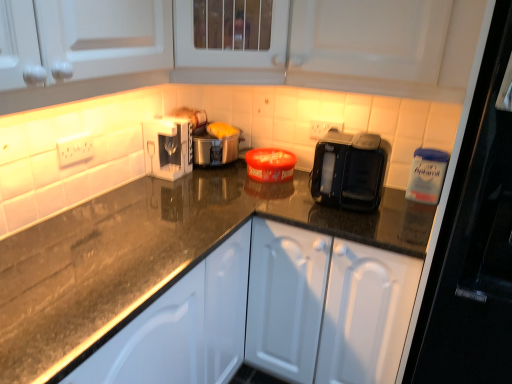
Find the location of a particular element. The image size is (512, 384). matte plastic toaster at center is located at coordinates (216, 146).

In order to click on white glossy coffee machine at upper center in this screenshot , I will do `click(168, 147)`.

Is white matte cabinet at center inside white glossy coffee machine at upper center?

No, white glossy coffee machine at upper center does not contain white matte cabinet at center.

In the image, is white glossy coffee machine at upper center positioned in front of or behind white matte cabinet at center?

Clearly, white glossy coffee machine at upper center is behind white matte cabinet at center.

Consider the image. From the image's perspective, is white glossy coffee machine at upper center above or below white matte cabinet at center?

white glossy coffee machine at upper center is above white matte cabinet at center.

From the image's perspective, who appears lower, matte plastic toaster at center or white glossy coffee machine at upper center?

white glossy coffee machine at upper center is shown below in the image.

Is point (202, 139) positioned before point (188, 158)?

No.

Considering the sizes of matte plastic toaster at center and white glossy coffee machine at upper center in the image, is matte plastic toaster at center taller or shorter than white glossy coffee machine at upper center?

In the image, matte plastic toaster at center appears to be taller than white glossy coffee machine at upper center.

Is matte plastic toaster at center thinner than white matte cabinet at center?

Yes.

Is the position of matte plastic toaster at center less distant than that of white matte cabinet at center?

No, matte plastic toaster at center is behind white matte cabinet at center.

Which object is positioned more to the left, matte plastic toaster at center or white matte cabinet at center?

matte plastic toaster at center is more to the left.

Do you think white glossy coffee machine at upper center is within matte plastic toaster at center, or outside of it?

white glossy coffee machine at upper center cannot be found inside matte plastic toaster at center.

Consider the image. Considering the relative sizes of white glossy coffee machine at upper center and matte plastic toaster at center in the image provided, is white glossy coffee machine at upper center bigger than matte plastic toaster at center?

No, white glossy coffee machine at upper center is not bigger than matte plastic toaster at center.

Which object is more forward, white glossy coffee machine at upper center or matte plastic toaster at center?

white glossy coffee machine at upper center is more forward.

From the image's perspective, which object appears higher, white glossy coffee machine at upper center or matte plastic toaster at center?

From the image's view, matte plastic toaster at center is above.

From the image's perspective, relative to white glossy coffee machine at upper center, is white matte cabinet at center above or below?

Clearly, from the image's perspective, white matte cabinet at center is below white glossy coffee machine at upper center.

Does white matte cabinet at center have a lesser height compared to white glossy coffee machine at upper center?

Incorrect, the height of white matte cabinet at center does not fall short of that of white glossy coffee machine at upper center.

Is white glossy coffee machine at upper center at the back of white matte cabinet at center?

white matte cabinet at center does not have its back to white glossy coffee machine at upper center.

How many degrees apart are the facing directions of white matte cabinet at center and white glossy coffee machine at upper center?

The angular difference between white matte cabinet at center and white glossy coffee machine at upper center is 89 degrees.

Which point is more distant from viewer, (301,246) or (231,151)?

The point (231,151) is behind.

Is white matte cabinet at center touching matte plastic toaster at center?

white matte cabinet at center and matte plastic toaster at center are clearly separated.

You are a GUI agent. You are given a task and a screenshot of the screen. Output one action in this format:
    pyautogui.click(x=<x>, y=<y>)
    Task: Click on the cabinetry that is below the matte plastic toaster at center (from the image's perspective)
    The image size is (512, 384).
    Given the screenshot: What is the action you would take?
    [326, 306]

Looking at this image, from a real-world perspective, who is located higher, white matte cabinet at center or matte plastic toaster at center?

From a 3D spatial view, matte plastic toaster at center is above.

Identify the location of cabinetry on the right of white glossy coffee machine at upper center. (326, 306).

This screenshot has height=384, width=512. I want to click on kitchen appliance on the left of matte plastic toaster at center, so click(x=168, y=147).

When comparing their distances from white matte cabinet at center, does white glossy coffee machine at upper center or matte plastic toaster at center seem closer?

matte plastic toaster at center lies closer to white matte cabinet at center than the other object.

From the image, which object appears to be nearer to matte plastic toaster at center, white glossy coffee machine at upper center or white matte cabinet at center?

white glossy coffee machine at upper center lies closer to matte plastic toaster at center than the other object.

Estimate the real-world distances between objects in this image. Which object is further from matte plastic toaster at center, white matte cabinet at center or white glossy coffee machine at upper center?

white matte cabinet at center is further to matte plastic toaster at center.

Estimate the real-world distances between objects in this image. Which object is closer to white glossy coffee machine at upper center, matte plastic toaster at center or white matte cabinet at center?

The object closer to white glossy coffee machine at upper center is matte plastic toaster at center.

Based on their spatial positions, is matte plastic toaster at center or white glossy coffee machine at upper center closer to white matte cabinet at center?

Among the two, matte plastic toaster at center is located nearer to white matte cabinet at center.

Consider the image. Which object lies nearer to the anchor point white glossy coffee machine at upper center, white matte cabinet at center or matte plastic toaster at center?

Based on the image, matte plastic toaster at center appears to be nearer to white glossy coffee machine at upper center.

Image resolution: width=512 pixels, height=384 pixels. In order to click on appliance between white glossy coffee machine at upper center and white matte cabinet at center in the horizontal direction in this screenshot , I will do `click(216, 146)`.